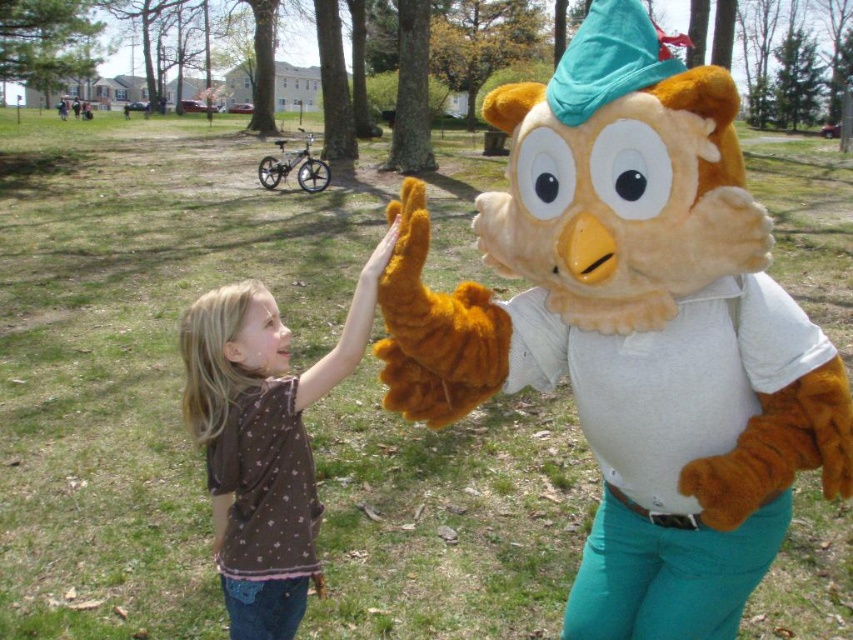
Who is positioned more to the left, fluffy brown owl at center or brown fabric shirt at center?

brown fabric shirt at center is more to the left.

Is point (842, 445) closer to camera compared to point (253, 577)?

Yes, it is in front of point (253, 577).

What are the coordinates of `fluffy brown owl at center` in the screenshot? It's located at (633, 328).